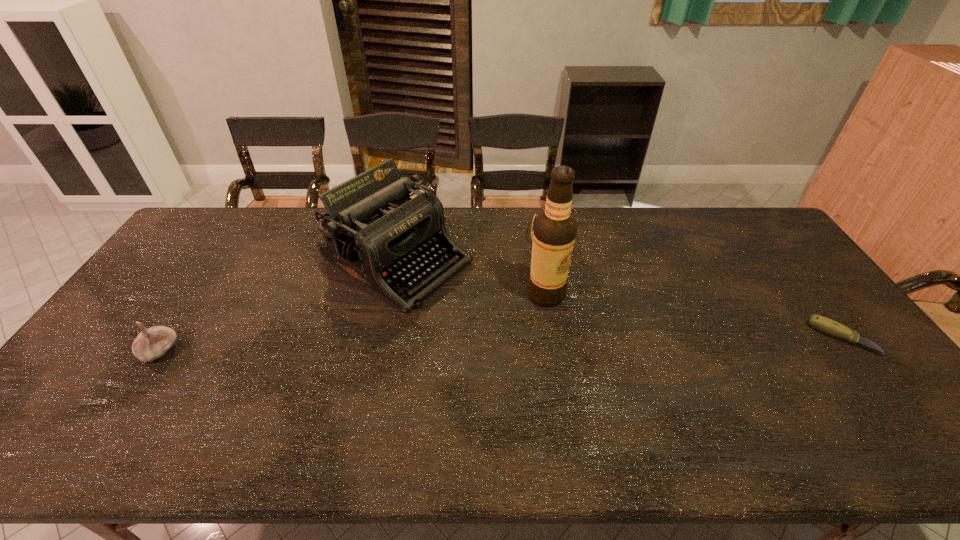
Where is `vacant space on the desktop that is between the garlic and the rightmost object and is positioned on the keyboard of the fourth object from right to left`? This screenshot has height=540, width=960. vacant space on the desktop that is between the garlic and the rightmost object and is positioned on the keyboard of the fourth object from right to left is located at coordinates (538, 344).

Where is `free space on the desktop that is between the garlic and the rightmost object and is positioned on the front-facing side of the sunglasses`? free space on the desktop that is between the garlic and the rightmost object and is positioned on the front-facing side of the sunglasses is located at coordinates (554, 343).

Locate an element on the screen. This screenshot has width=960, height=540. vacant spot on the desktop that is between the leftmost object and the shortest object and is positioned on the label of the tallest object is located at coordinates (580, 343).